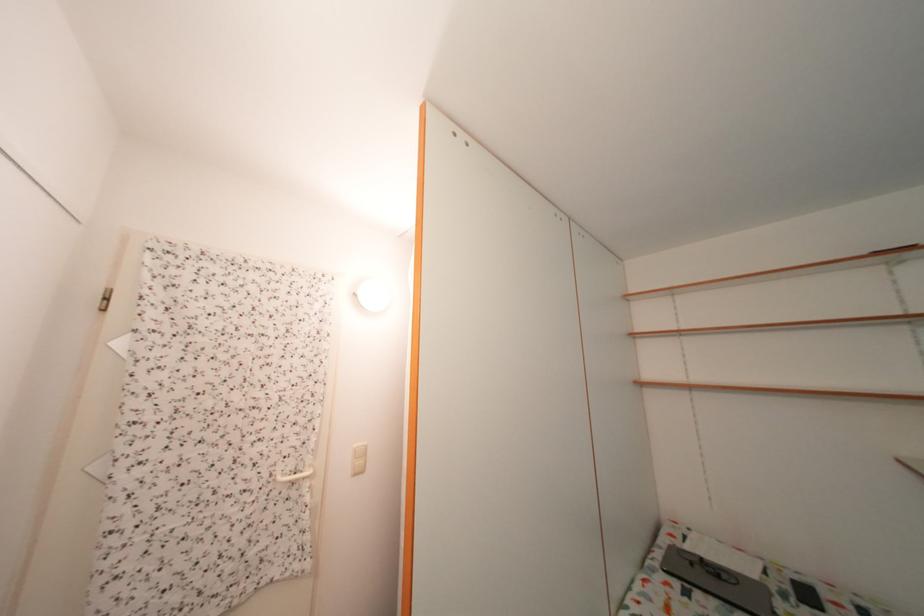
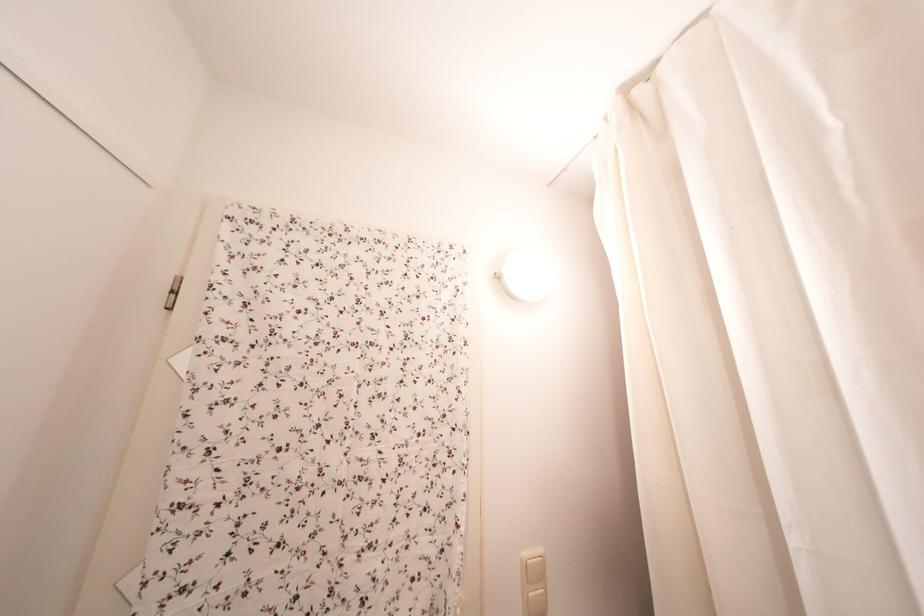
Locate, in the second image, the point that corresponds to (x=366, y=451) in the first image.

(536, 560)